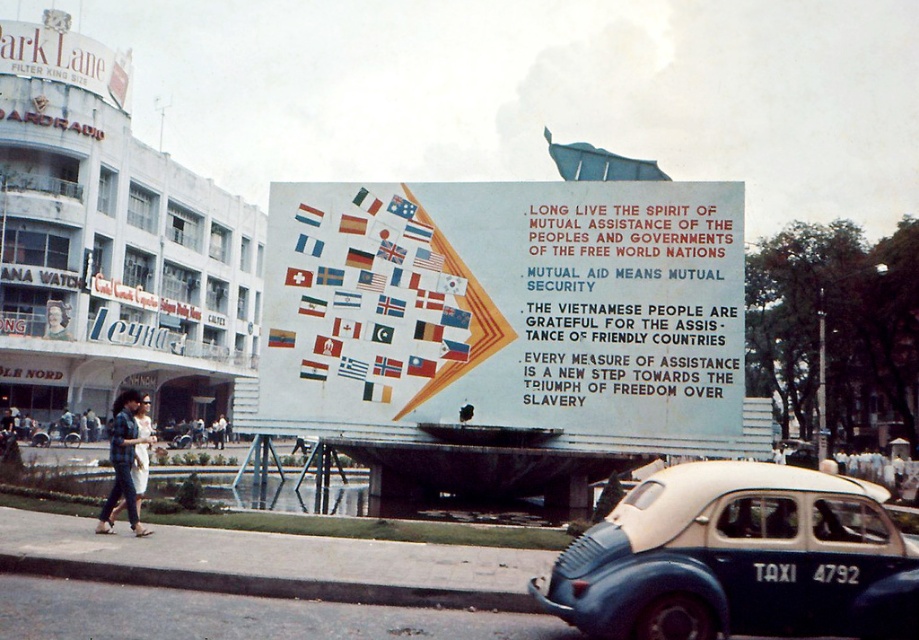
Question: Where is blue matte taxi cab at lower right located in relation to plaid shirt at lower left in the image?

Choices:
 (A) below
 (B) above

Answer: (A)

Question: Among these objects, which one is farthest from the camera?

Choices:
 (A) white painted billboard at center
 (B) blue matte taxi cab at lower right
 (C) plaid shirt at lower left

Answer: (A)

Question: Does blue matte taxi cab at lower right lie behind plaid shirt at lower left?

Choices:
 (A) no
 (B) yes

Answer: (A)

Question: Which point is closer to the camera?

Choices:
 (A) (598, 268)
 (B) (810, 486)
 (C) (115, 476)

Answer: (B)

Question: Is blue matte taxi cab at lower right closer to camera compared to plaid shirt at lower left?

Choices:
 (A) yes
 (B) no

Answer: (A)

Question: Among these points, which one is farthest from the camera?

Choices:
 (A) (467, 369)
 (B) (600, 605)

Answer: (A)